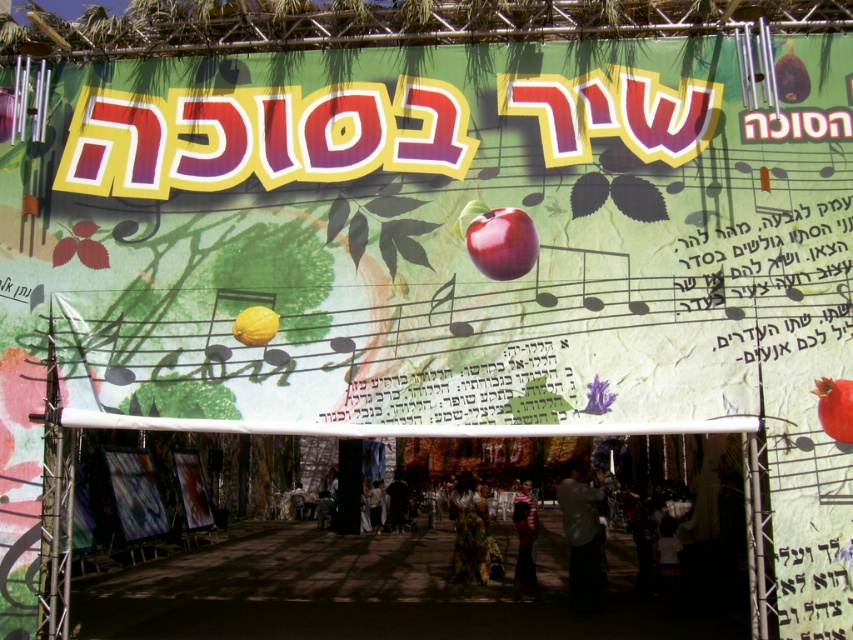
You are at the event and want to take a photo of the banner. You notice two points on the banner marked as point 1 and point 2. If point 1 is at coordinate (x=469, y=518) and point 2 is at coordinate (x=238, y=337), which point is closer to you when you take the photo?

Point 1 at coordinate (x=469, y=518) is further to the camera than point 2 at coordinate (x=238, y=337), so point 2 is closer to you when taking the photo.

You are a photographer at the event and need to ensure both the dark gray shirt at center and the shiny red apple at center are visible in your photo. Given their positions, which object might you need to adjust your camera angle to capture fully?

The dark gray shirt at center is taller than the shiny red apple at center, so you might need to adjust your camera angle to capture the taller dark gray shirt at center fully.